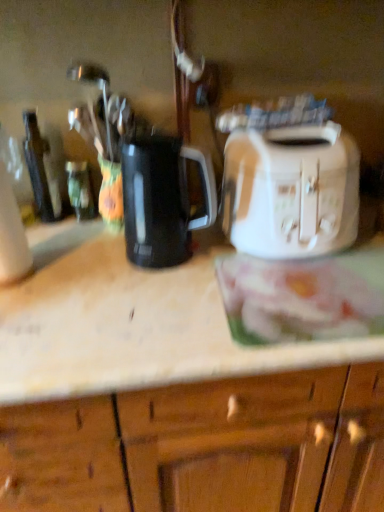
Find the location of a particular element. This screenshot has height=512, width=384. blank space situated above white glossy bread at center (from a real-world perspective) is located at coordinates coord(311,282).